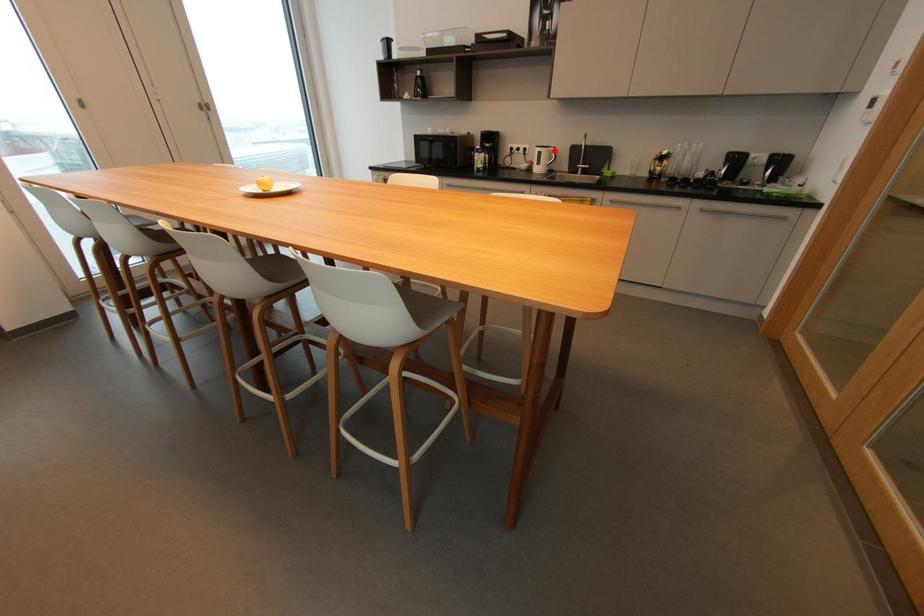
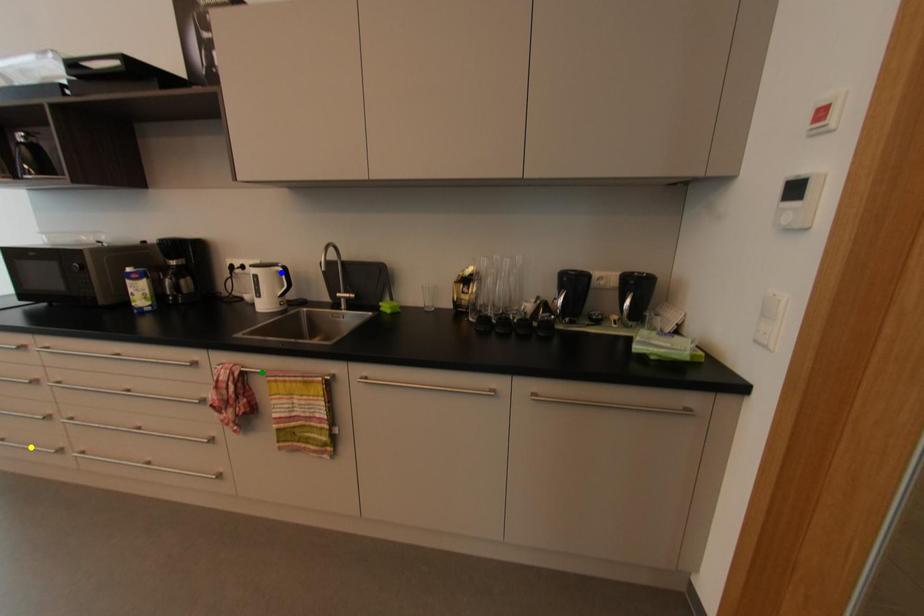
Question: I am providing you with two images of the same scene from different viewpoints. A red point is marked on the first image. You are given multiple points on the second image. In image 2, which mark is for the same physical point as the one in image 1?

Choices:
 (A) yellow point
 (B) blue point
 (C) green point

Answer: (B)